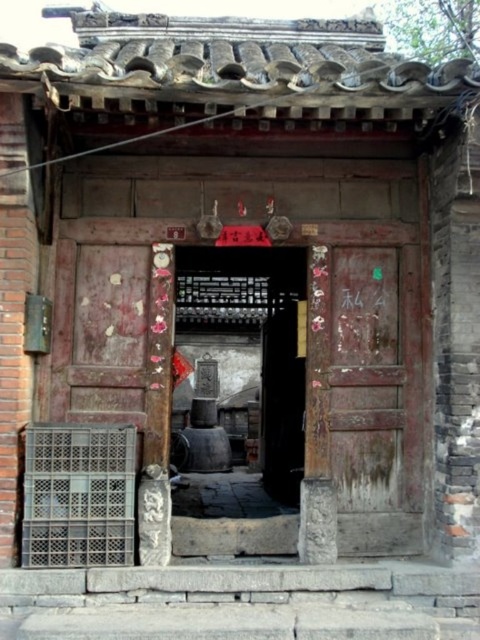
Question: Is wooden door at center bigger than white paper at center?

Choices:
 (A) no
 (B) yes

Answer: (B)

Question: From the image, what is the correct spatial relationship of rusty wooden door at center in relation to white paper at center?

Choices:
 (A) above
 (B) below

Answer: (B)

Question: Based on their relative distances, which object is nearer to the rusty wooden door at center?

Choices:
 (A) wooden door at center
 (B) white paper at center

Answer: (B)

Question: Among these points, which one is farthest from the camera?

Choices:
 (A) (342, 289)
 (B) (382, 326)

Answer: (A)

Question: Is wooden door at center above rusty wooden door at center?

Choices:
 (A) no
 (B) yes

Answer: (A)

Question: Which object appears farthest from the camera in this image?

Choices:
 (A) wooden door at center
 (B) white paper at center

Answer: (A)